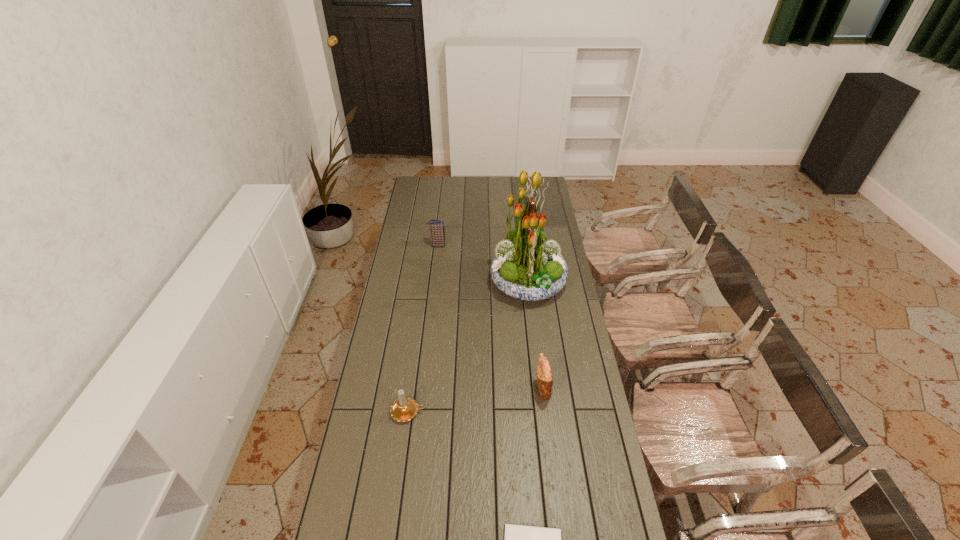
Image resolution: width=960 pixels, height=540 pixels. I want to click on the fourth nearest object, so click(526, 267).

Locate an element on the screen. The height and width of the screenshot is (540, 960). the tallest object is located at coordinates pyautogui.click(x=526, y=267).

This screenshot has height=540, width=960. Find the location of `the farthest object`. the farthest object is located at coordinates (437, 232).

This screenshot has width=960, height=540. I want to click on the farther clutch bag, so click(437, 232).

Find the location of a particular element. The width and height of the screenshot is (960, 540). the right clutch bag is located at coordinates (544, 372).

Where is `candle`? The width and height of the screenshot is (960, 540). candle is located at coordinates (404, 409).

This screenshot has width=960, height=540. Find the location of `vacant space located 0.320m on the front-facing side of the tallest object`. vacant space located 0.320m on the front-facing side of the tallest object is located at coordinates (423, 284).

You are a GUI agent. You are given a task and a screenshot of the screen. Output one action in this format:
    pyautogui.click(x=<x>, y=<y>)
    Task: Click on the vacant region located on the front-facing side of the tallest object
    Image resolution: width=960 pixels, height=540 pixels.
    Given the screenshot: What is the action you would take?
    pyautogui.click(x=457, y=284)

The width and height of the screenshot is (960, 540). In order to click on free space located 0.110m on the front-facing side of the tallest object in this screenshot , I will do `click(468, 284)`.

Locate an element on the screen. The height and width of the screenshot is (540, 960). blank space located with the zip open on the left clutch bag is located at coordinates (517, 245).